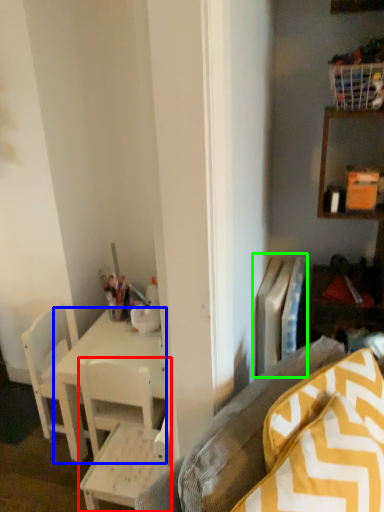
Question: Which object is positioned farthest from chair (highlighted by a red box)? Select from desk (highlighted by a blue box) and radiator (highlighted by a green box).

Choices:
 (A) desk
 (B) radiator

Answer: (B)